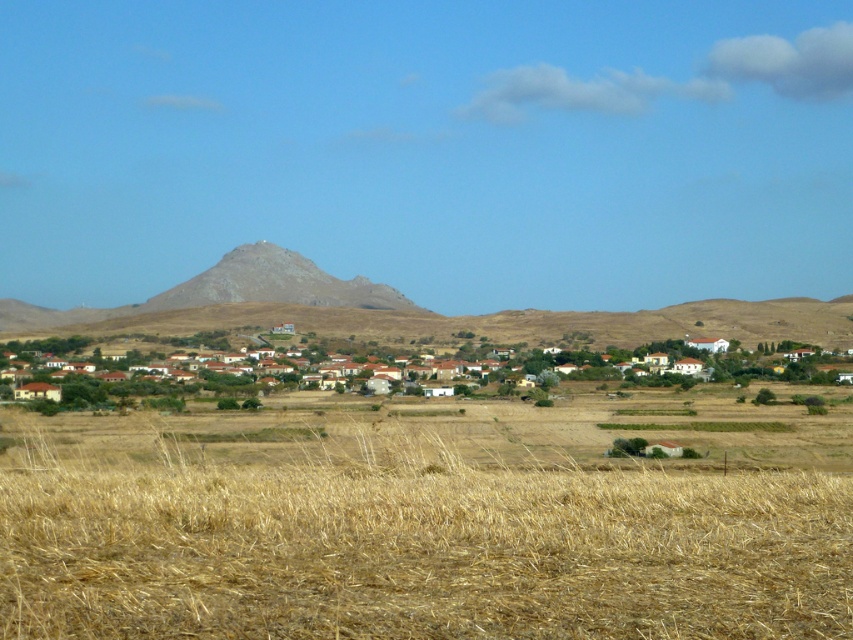
You are standing in the rural landscape and want to walk from the point closer to you to the farther point. Which path would you take between the two points, point (161, 616) and point (630, 353)?

The path from point (161, 616) to point (630, 353) would require moving away from the viewer, as point (161, 616) is closer to you and point (630, 353) is farther away.

You are a farmer planning to plant new crops in the dry straw field at lower center and the brown clay houses at center. Which area has more space available for planting?

The dry straw field at lower center has more space available for planting since it is bigger than the brown clay houses at center.